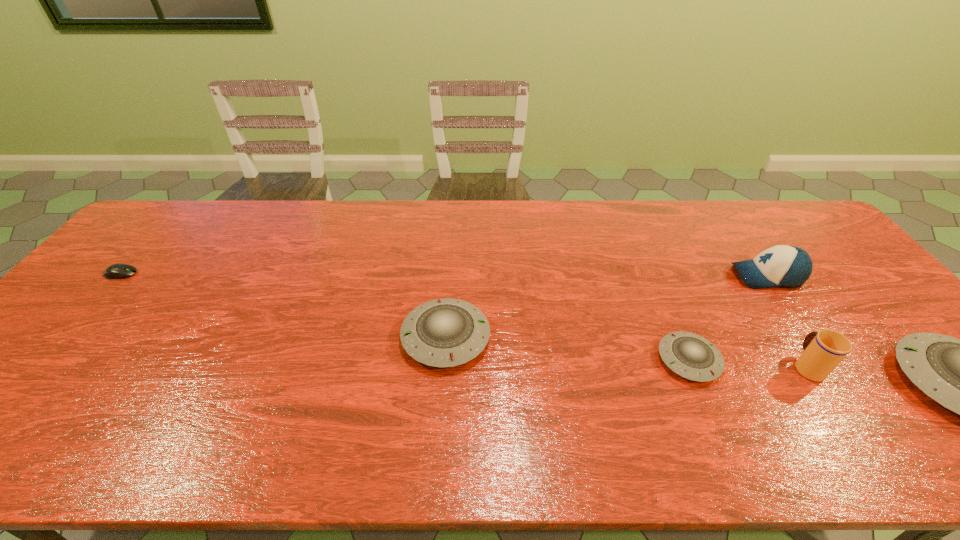
In order to click on free region at the far edge of the desktop in this screenshot , I will do `click(533, 215)`.

I want to click on vacant space at the near edge of the desktop, so click(x=870, y=402).

The height and width of the screenshot is (540, 960). I want to click on vacant area at the far left corner, so click(x=154, y=219).

Identify the location of vacant space at the far right corner. (794, 212).

I want to click on free point between the shortest object and the fifth object from right to left, so click(x=283, y=306).

What are the coordinates of `free spot between the third object from left to right and the cup` in the screenshot? It's located at (748, 363).

This screenshot has height=540, width=960. Identify the location of vacant area between the leftmost saucer and the third object from left to right. (567, 348).

What are the coordinates of `vacant area that lies between the fifth object from right to left and the baseball cap` in the screenshot? It's located at (607, 307).

Locate an element on the screen. object that stands as the fifth closest to the cup is located at coordinates (116, 271).

I want to click on the third closest object to the shortest saucer, so tap(959, 374).